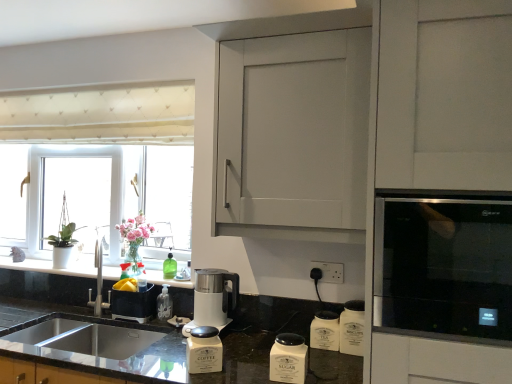
Question: Does stainless steel sink at lower left have a greater width compared to white matte sugar container at lower center, the fourth appliance viewed from the left?

Choices:
 (A) yes
 (B) no

Answer: (A)

Question: Is white matte sugar container at lower center, the fourth appliance viewed from the left, completely or partially inside stainless steel sink at lower left?

Choices:
 (A) yes
 (B) no

Answer: (B)

Question: Are stainless steel sink at lower left and white matte sugar container at lower center, marked as the 3th appliance in a right-to-left arrangement, located far from each other?

Choices:
 (A) no
 (B) yes

Answer: (B)

Question: Is stainless steel sink at lower left next to white matte sugar container at lower center, marked as the 3th appliance in a right-to-left arrangement?

Choices:
 (A) no
 (B) yes

Answer: (A)

Question: Does stainless steel sink at lower left turn towards white matte sugar container at lower center, the fourth appliance viewed from the left?

Choices:
 (A) yes
 (B) no

Answer: (B)

Question: Choose the correct answer: Is white ceramic canisters at lower center, which is the 2th appliance from right to left, inside matte black container at lower left, the first appliance when ordered from left to right, or outside it?

Choices:
 (A) inside
 (B) outside

Answer: (B)

Question: Is white ceramic canisters at lower center, which is the 2th appliance from right to left, in front of or behind matte black container at lower left, which is counted as the 6th appliance, starting from the right, in the image?

Choices:
 (A) front
 (B) behind

Answer: (A)

Question: Considering the positions of white ceramic canisters at lower center, which is the fifth appliance from left to right, and matte black container at lower left, which is counted as the 6th appliance, starting from the right, in the image, is white ceramic canisters at lower center, which is the fifth appliance from left to right, wider or thinner than matte black container at lower left, which is counted as the 6th appliance, starting from the right,?

Choices:
 (A) thin
 (B) wide

Answer: (B)

Question: Is point (309, 332) positioned closer to the camera than point (141, 294)?

Choices:
 (A) farther
 (B) closer

Answer: (B)

Question: Which is correct: black granite countertop at lower center, the second countertop when ordered from top to bottom, is inside white ceramic canisters at lower center, which is the 2th appliance from right to left, or outside of it?

Choices:
 (A) outside
 (B) inside

Answer: (A)

Question: Considering the relative positions of black granite countertop at lower center, the second countertop when ordered from top to bottom, and white ceramic canisters at lower center, which is the 2th appliance from right to left, in the image provided, is black granite countertop at lower center, the second countertop when ordered from top to bottom, to the left or to the right of white ceramic canisters at lower center, which is the 2th appliance from right to left,?

Choices:
 (A) right
 (B) left

Answer: (B)

Question: In the image, is black granite countertop at lower center, the second countertop when ordered from top to bottom, positioned in front of or behind white ceramic canisters at lower center, which is the fifth appliance from left to right?

Choices:
 (A) front
 (B) behind

Answer: (A)

Question: In terms of size, does black granite countertop at lower center, which is counted as the first countertop, starting from the bottom, appear bigger or smaller than white ceramic canisters at lower center, which is the fifth appliance from left to right?

Choices:
 (A) small
 (B) big

Answer: (B)

Question: Considering the positions of white matte sugar container at lower center, the fourth appliance viewed from the left, and white plastic window at left in the image, is white matte sugar container at lower center, the fourth appliance viewed from the left, wider or thinner than white plastic window at left?

Choices:
 (A) wide
 (B) thin

Answer: (B)

Question: From the image's perspective, relative to white plastic window at left, is white matte sugar container at lower center, the fourth appliance viewed from the left, above or below?

Choices:
 (A) below
 (B) above

Answer: (A)